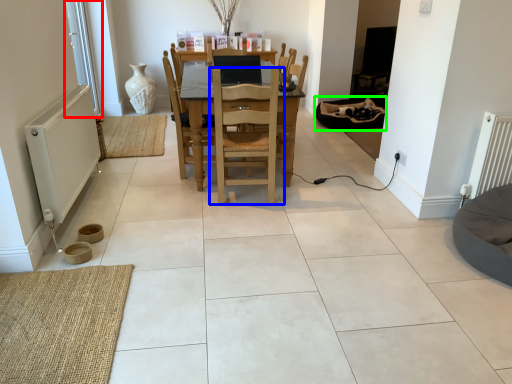
Question: Which object is the farthest from window screen (highlighted by a red box)? Choose among these: chair (highlighted by a blue box) or bean bag chair (highlighted by a green box).

Choices:
 (A) chair
 (B) bean bag chair

Answer: (B)